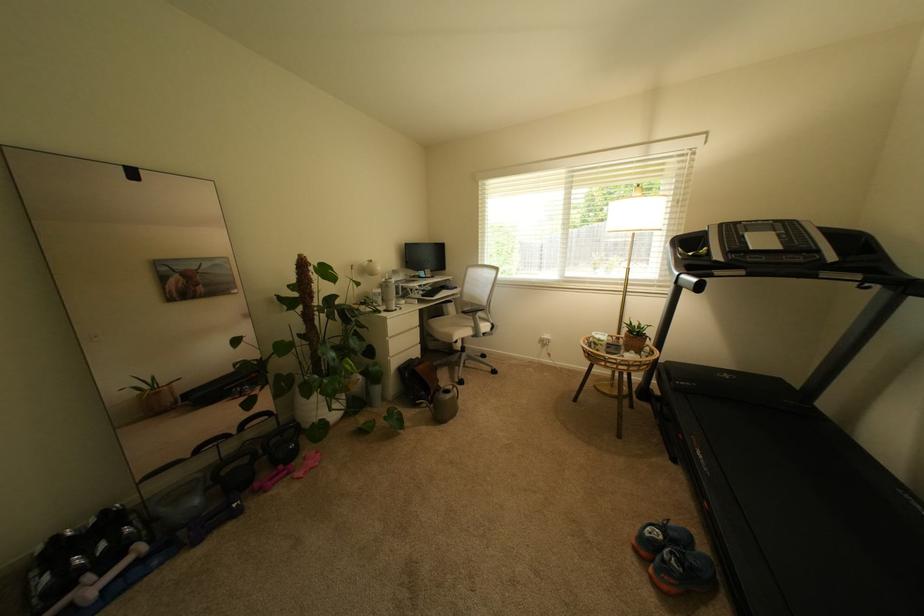
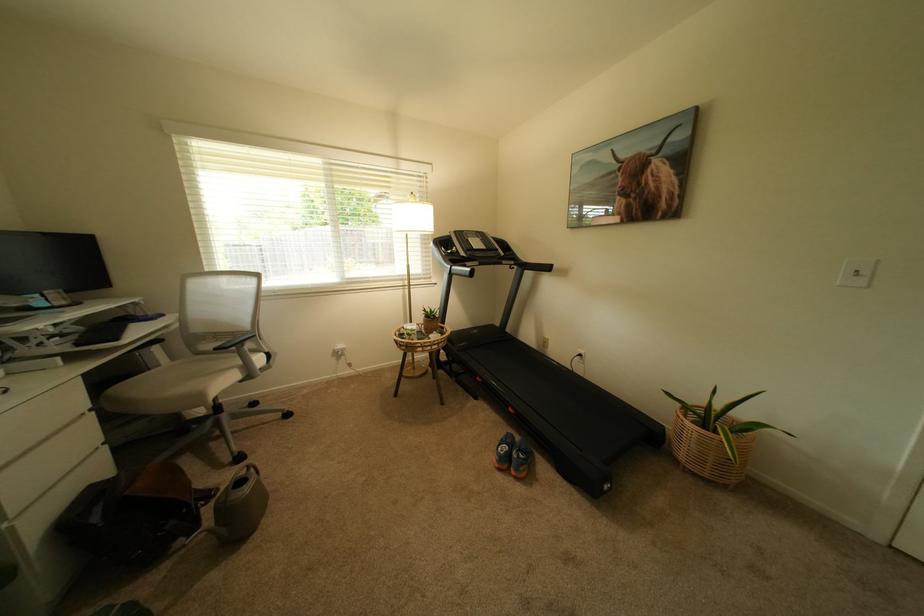
Locate, in the second image, the point that corresponds to point (673, 540) in the first image.

(517, 448)